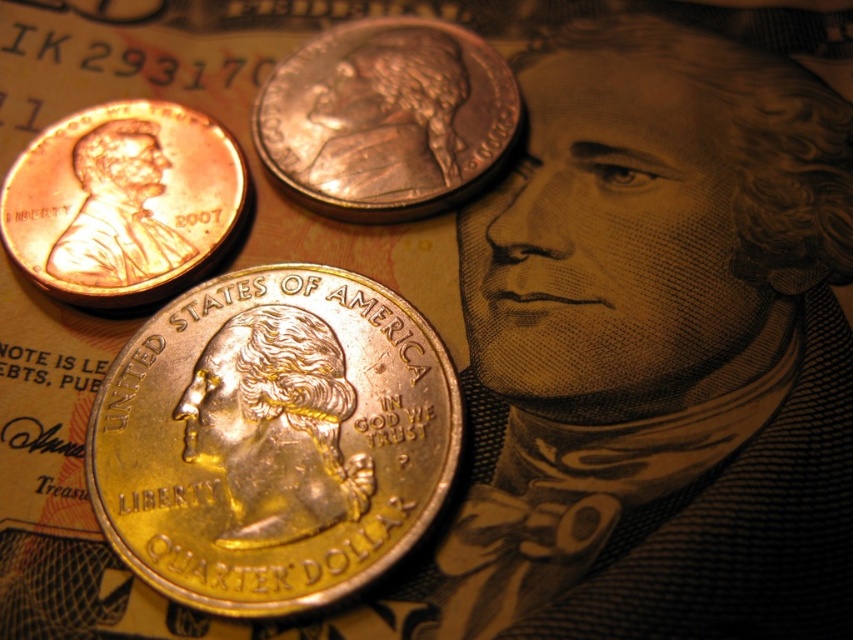
You are a cashier who needs to place a new coin on the twenty dollar bill in the image so that it is directly below the shiny copper coin at upper center. What coordinates should you use?

The shiny copper coin at upper center is at point (386, 116). To place a new coin directly below it, you should use the same x coordinate and a lower y coordinate, so the coordinates would be approximately (386, 116) minus some value. However, since the exact distance isn